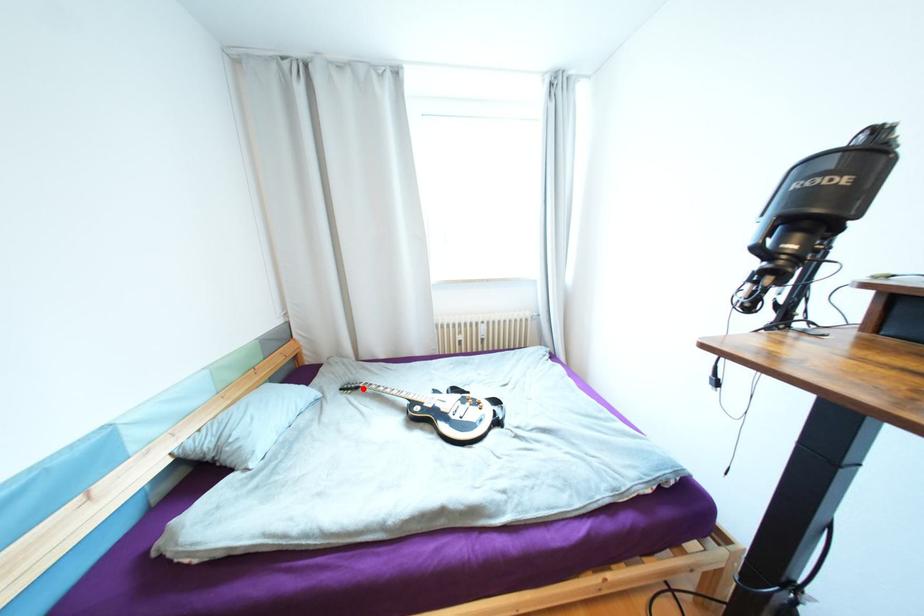
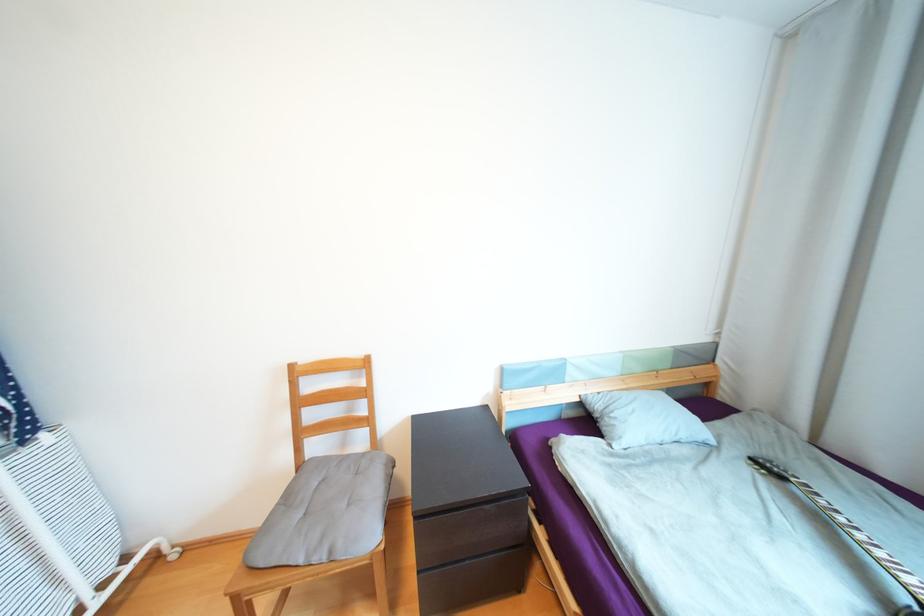
Where in the second image is the point corresponding to the highlighted location from the first image?

(787, 477)